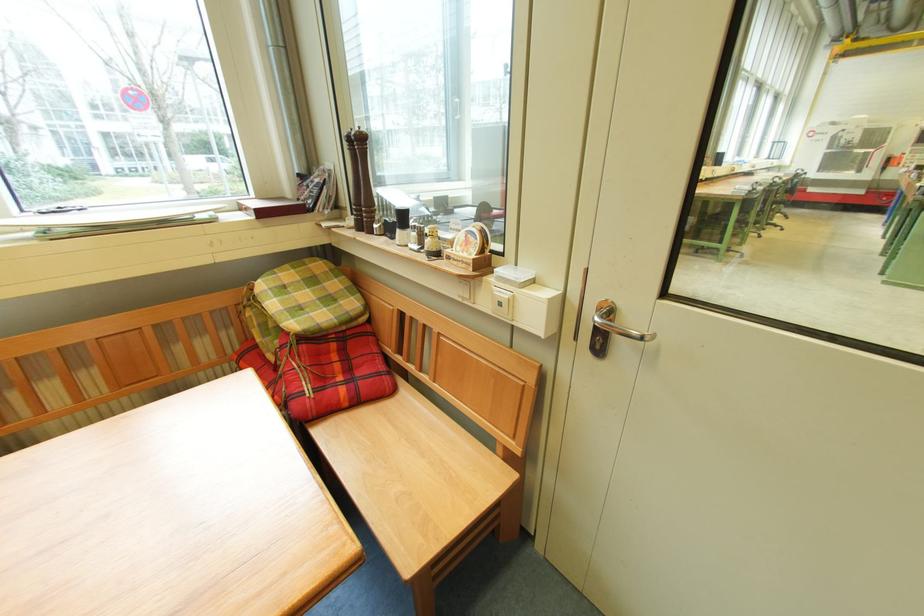
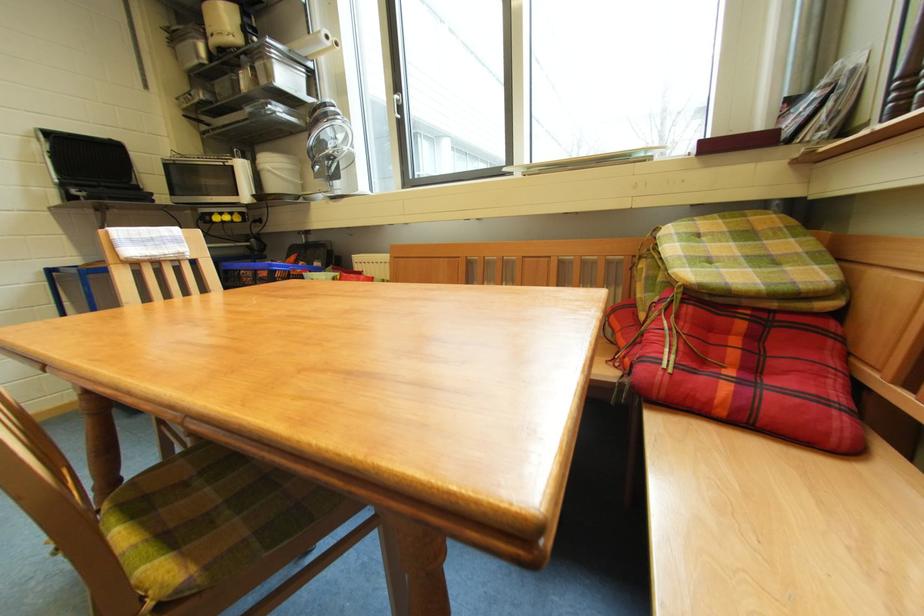
Where in the second image is the point corresponding to the point at 310,349 from the first image?

(698, 310)